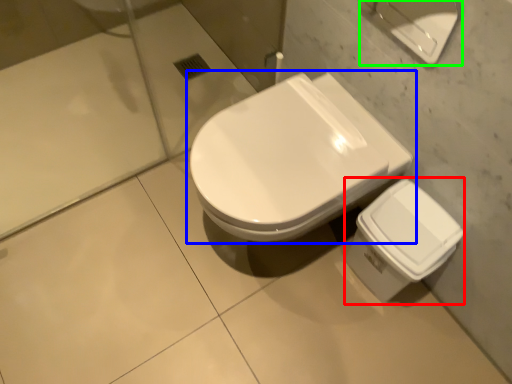
Question: Which object is positioned farthest from porcelain (highlighted by a red box)? Select from toilet (highlighted by a blue box) and porcelain (highlighted by a green box).

Choices:
 (A) toilet
 (B) porcelain

Answer: (B)